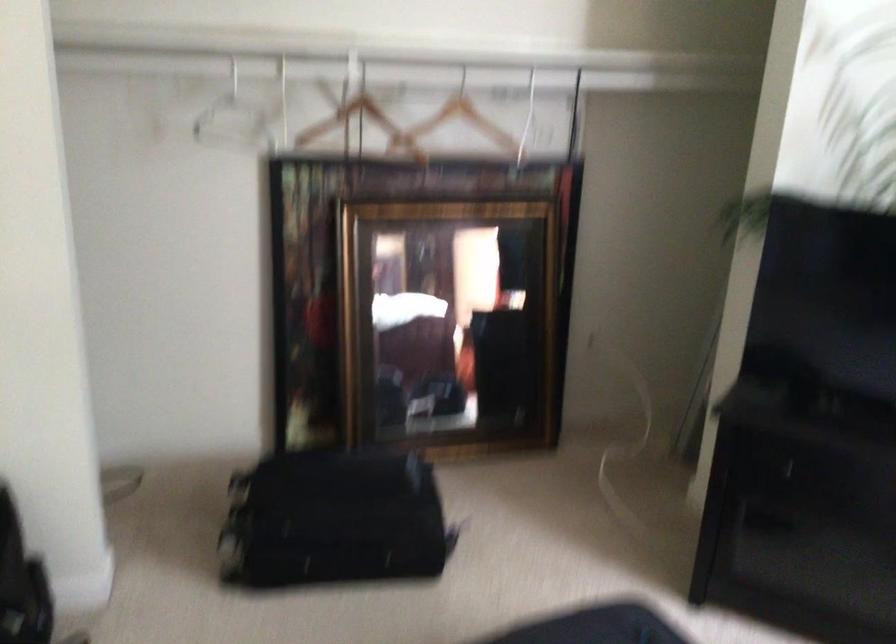
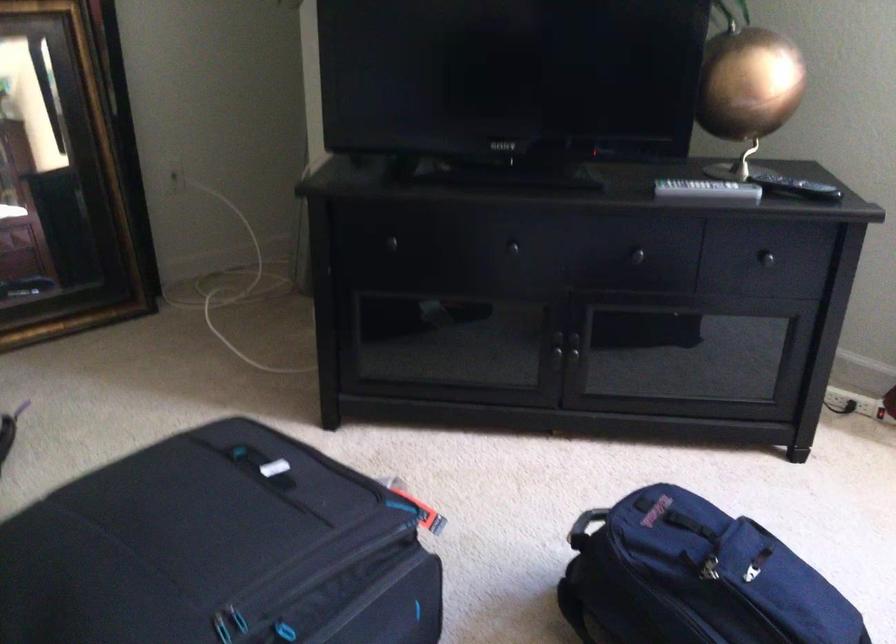
In a continuous first-person perspective shot, in which direction is the camera moving?

The cameraman walked toward right, forward.